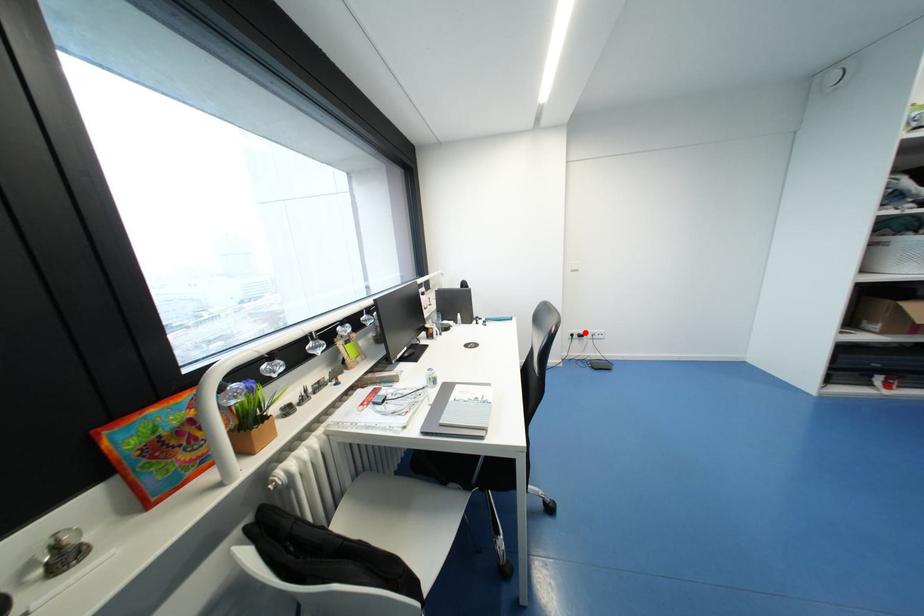
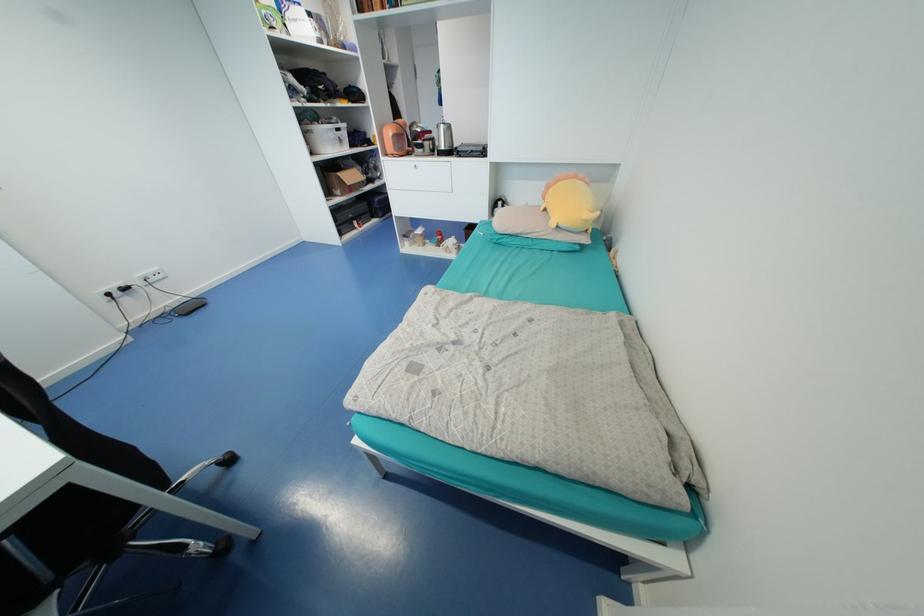
Question: A red point is marked in image1. In image2, is the corresponding 3D point closer to the camera or farther? Reply with the corresponding letter.

Choices:
 (A) The corresponding 3D point is closer.
 (B) The corresponding 3D point is farther.

Answer: (A)